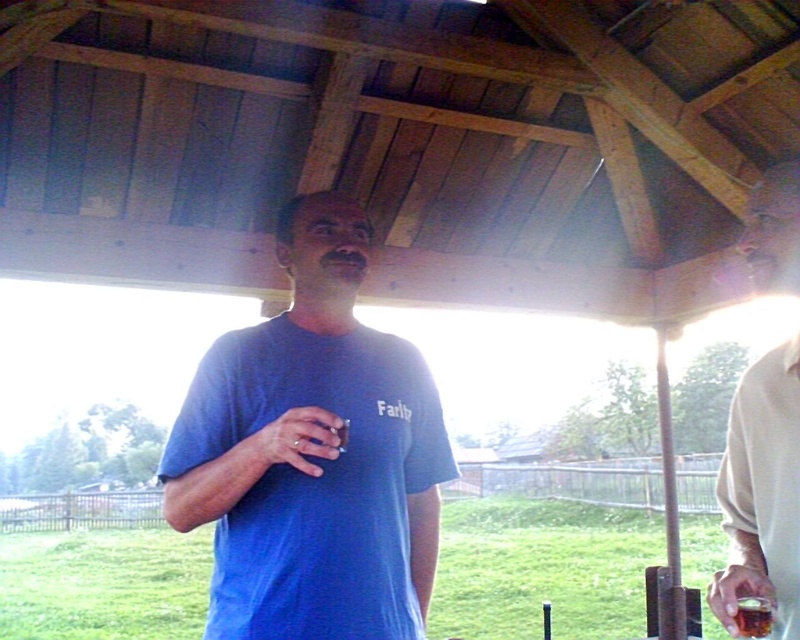
Question: Can you confirm if beige fabric shirt at right is smaller than translucent glass cup at lower right?

Choices:
 (A) yes
 (B) no

Answer: (B)

Question: Considering the relative positions of beige fabric shirt at right and translucent glass cup at lower right in the image provided, where is beige fabric shirt at right located with respect to translucent glass cup at lower right?

Choices:
 (A) above
 (B) below

Answer: (A)

Question: Which point is closer to the camera taking this photo?

Choices:
 (A) (192, 440)
 (B) (748, 621)
 (C) (750, 417)

Answer: (B)

Question: Which of the following is the farthest from the observer?

Choices:
 (A) beige fabric shirt at right
 (B) translucent glass cup at lower right
 (C) blue cotton t-shirt at center

Answer: (B)

Question: Observing the image, what is the correct spatial positioning of blue cotton t-shirt at center in reference to translucent glass cup at lower right?

Choices:
 (A) above
 (B) below

Answer: (A)

Question: Estimate the real-world distances between objects in this image. Which object is farther from the blue cotton t-shirt at center?

Choices:
 (A) translucent glass cup at lower right
 (B) beige fabric shirt at right

Answer: (A)